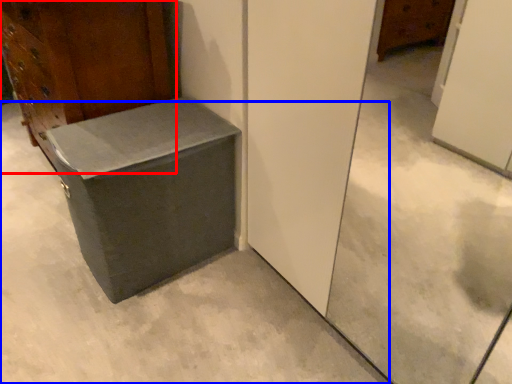
Question: Which of the following is the closest to the observer, furniture (highlighted by a red box) or concrete (highlighted by a blue box)?

Choices:
 (A) furniture
 (B) concrete

Answer: (B)